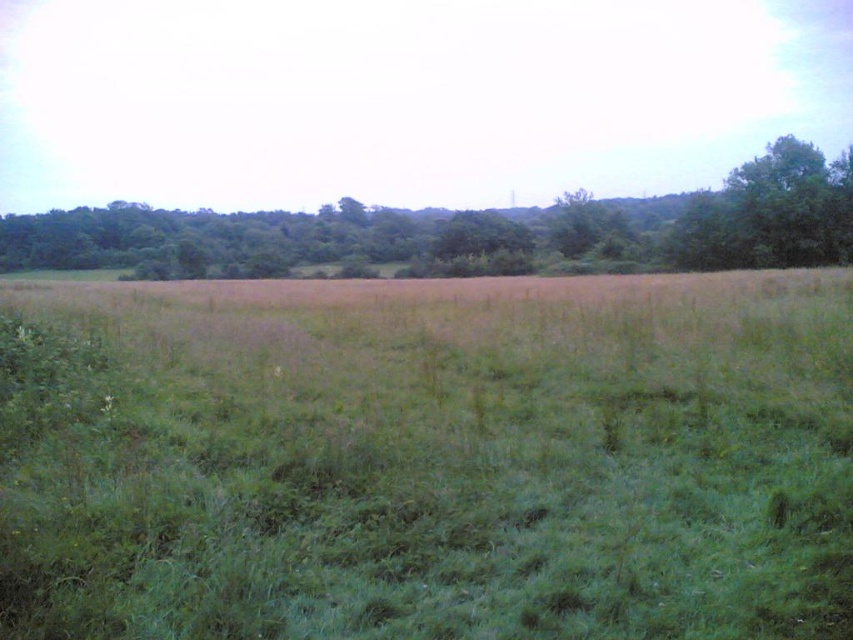
Question: Estimate the real-world distances between objects in this image. Which object is farther from the green leafy tree at upper center?

Choices:
 (A) green leafy tree at upper right
 (B) green grassy field at center

Answer: (B)

Question: Among these objects, which one is nearest to the camera?

Choices:
 (A) green leafy tree at upper center
 (B) green grassy field at center
 (C) green leafy tree at upper right

Answer: (B)

Question: Is the position of green leafy tree at upper center more distant than that of green leafy tree at upper right?

Choices:
 (A) no
 (B) yes

Answer: (B)

Question: Which point is farther to the camera?

Choices:
 (A) (42, 460)
 (B) (697, 216)
 (C) (717, 237)

Answer: (B)

Question: Is green grassy field at center bigger than green leafy tree at upper center?

Choices:
 (A) yes
 (B) no

Answer: (B)

Question: Does green leafy tree at upper center appear over green leafy tree at upper right?

Choices:
 (A) yes
 (B) no

Answer: (A)